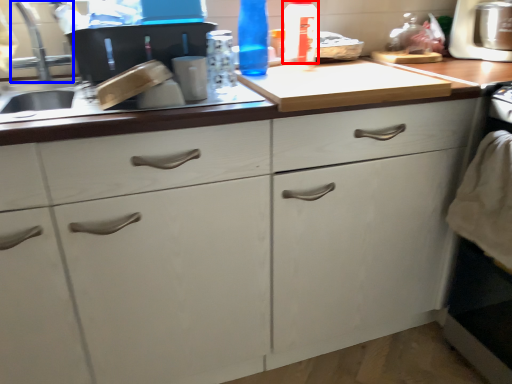
Question: Which object is further to the camera taking this photo, bottle (highlighted by a red box) or faucet (highlighted by a blue box)?

Choices:
 (A) bottle
 (B) faucet

Answer: (A)